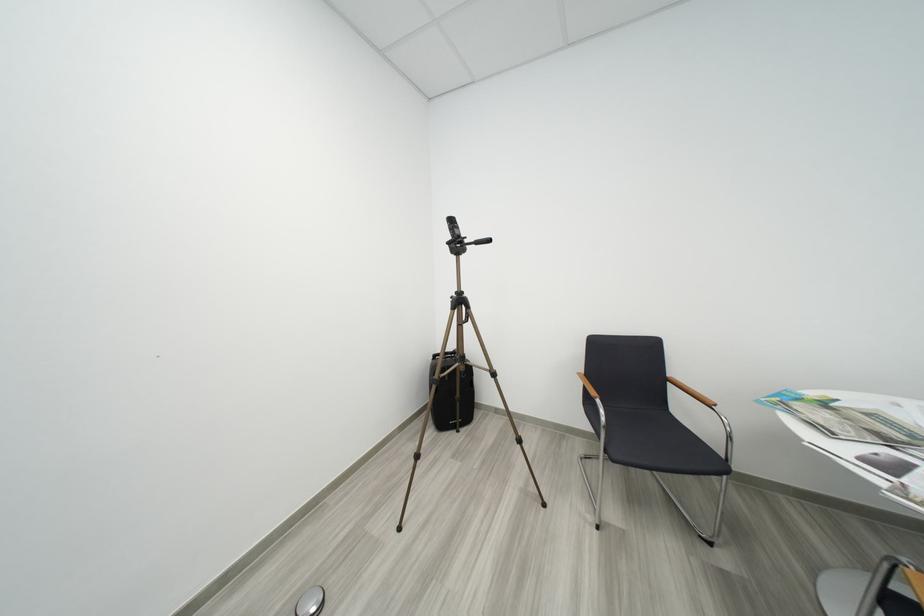
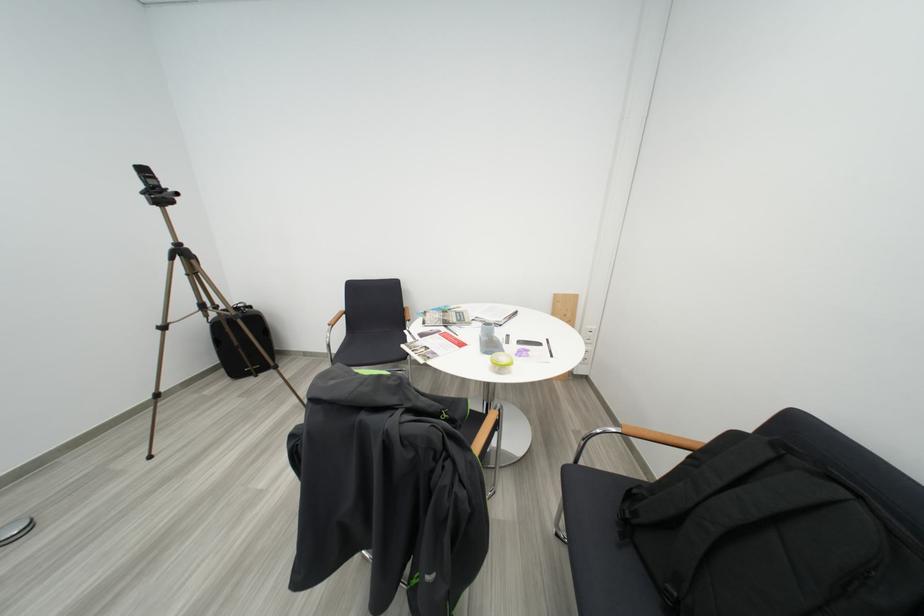
What movement of the cameraman would produce the second image?

The movement direction of the cameraman is right, backward.